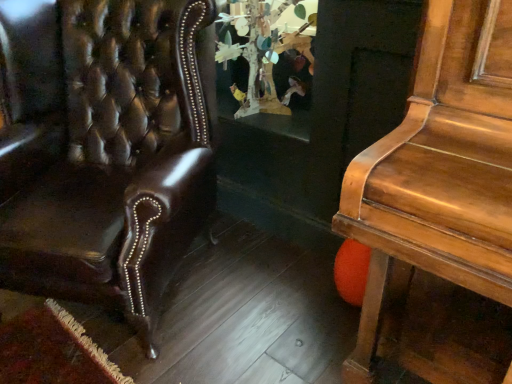
Question: Is wooden tree sculpture at center facing away from shiny brown leather chair at left?

Choices:
 (A) no
 (B) yes

Answer: (A)

Question: Can you confirm if wooden tree sculpture at center is thinner than shiny brown leather chair at left?

Choices:
 (A) yes
 (B) no

Answer: (A)

Question: Considering the relative positions of wooden tree sculpture at center and shiny brown leather chair at left in the image provided, is wooden tree sculpture at center to the left of shiny brown leather chair at left from the viewer's perspective?

Choices:
 (A) no
 (B) yes

Answer: (A)

Question: Is wooden tree sculpture at center at the right side of shiny brown leather chair at left?

Choices:
 (A) yes
 (B) no

Answer: (A)

Question: From a real-world perspective, is wooden tree sculpture at center beneath shiny brown leather chair at left?

Choices:
 (A) no
 (B) yes

Answer: (A)

Question: From the image's perspective, is wooden tree sculpture at center located above shiny brown leather chair at left?

Choices:
 (A) yes
 (B) no

Answer: (A)

Question: Is shiny brown leather chair at left smaller than wooden tree sculpture at center?

Choices:
 (A) no
 (B) yes

Answer: (A)

Question: Is shiny brown leather chair at left behind wooden tree sculpture at center?

Choices:
 (A) no
 (B) yes

Answer: (A)

Question: Can you confirm if shiny brown leather chair at left is positioned to the right of wooden tree sculpture at center?

Choices:
 (A) yes
 (B) no

Answer: (B)

Question: From a real-world perspective, is shiny brown leather chair at left physically above wooden tree sculpture at center?

Choices:
 (A) yes
 (B) no

Answer: (B)

Question: Considering the relative sizes of shiny brown leather chair at left and wooden tree sculpture at center in the image provided, is shiny brown leather chair at left shorter than wooden tree sculpture at center?

Choices:
 (A) no
 (B) yes

Answer: (A)

Question: Does shiny brown leather chair at left appear on the left side of wooden tree sculpture at center?

Choices:
 (A) yes
 (B) no

Answer: (A)

Question: Looking at the image, does shiny brown leather chair at left seem bigger or smaller compared to wooden tree sculpture at center?

Choices:
 (A) small
 (B) big

Answer: (B)